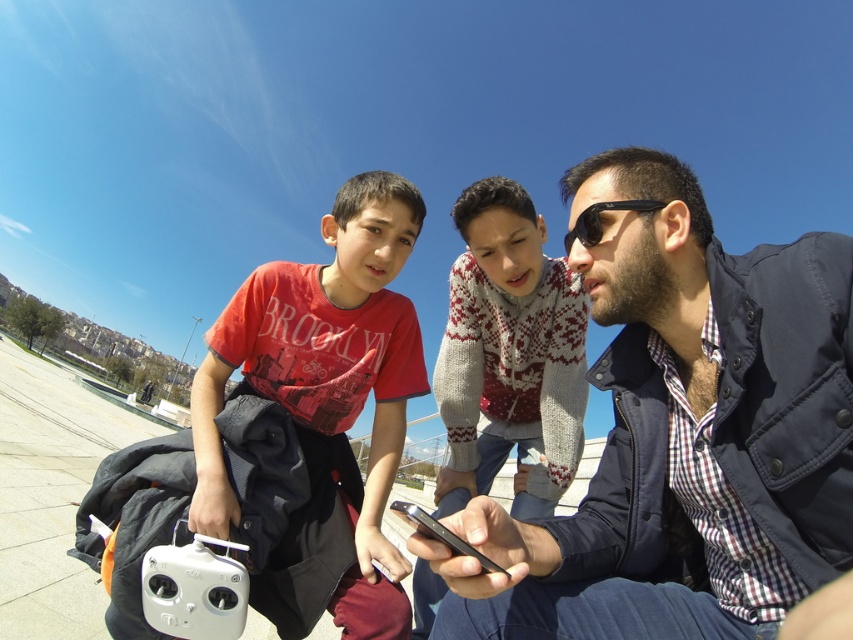
Does matte red t-shirt at center appear over black matte smartphone at center?

Correct, matte red t-shirt at center is located above black matte smartphone at center.

What do you see at coordinates (328, 378) in the screenshot?
I see `matte red t-shirt at center` at bounding box center [328, 378].

Is point (364, 200) behind point (492, 564)?

Yes, it is.

Locate an element on the screen. Image resolution: width=853 pixels, height=640 pixels. matte red t-shirt at center is located at coordinates (328, 378).

Which is behind, point (602, 573) or point (432, 520)?

Point (602, 573)

Which is below, dark blue jacket at center or black matte smartphone at center?

black matte smartphone at center

Which is behind, point (712, 579) or point (401, 513)?

Positioned behind is point (712, 579).

Find the location of `dark blue jacket at center`. dark blue jacket at center is located at coordinates (683, 435).

Looking at this image, does dark blue jacket at center have a lesser width compared to knitted sweater at center?

No.

Consider the image. Can you confirm if dark blue jacket at center is wider than knitted sweater at center?

Indeed, dark blue jacket at center has a greater width compared to knitted sweater at center.

Who is more forward, (573, 252) or (460, 461)?

Point (573, 252)

This screenshot has width=853, height=640. I want to click on dark blue jacket at center, so click(683, 435).